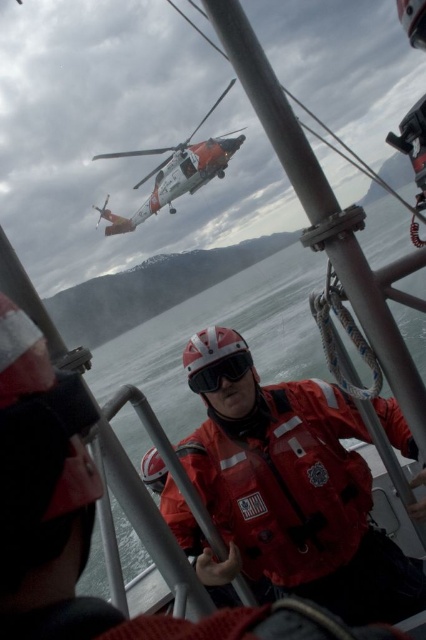
You are a rescue team member observing the scene. You need to locate the red matte life jacket at center and the orange matte helicopter at upper center. Which object is located to the right of the other?

The red matte life jacket at center is positioned on the right side of orange matte helicopter at upper center.

Consider the image. You are a rescue team member on the boat and need to secure a safety net between the red matte life jacket at center and the orange matte helicopter at upper center. Given their sizes, will the net fit properly?

The red matte life jacket at center is narrower than the orange matte helicopter at upper center, so the safety net should fit properly between them as the jacket is smaller in width.